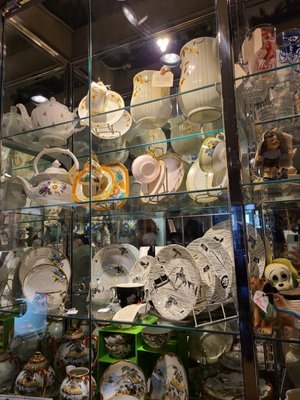
Identify the location of metal frame of the shelf. (235, 175).